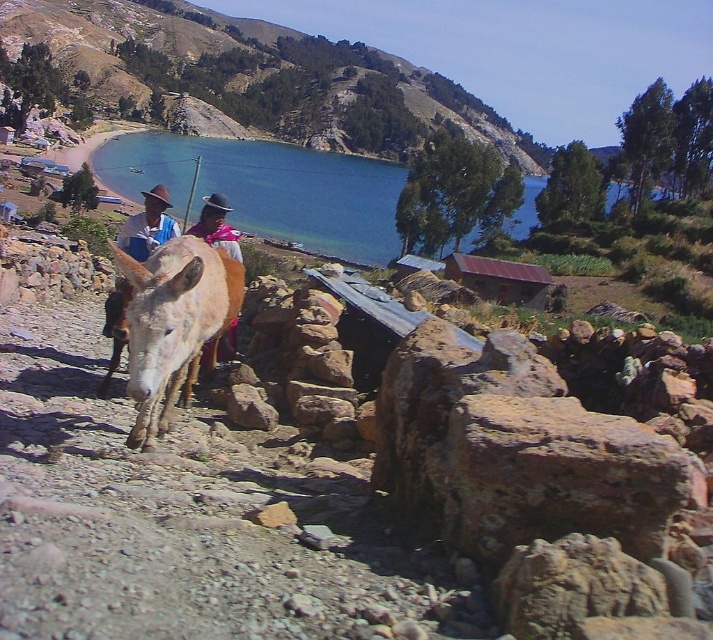
You are a photographer trying to capture the donkey and the hillside in a single frame. Based on the scene, can you determine if the green grassy hillside at upper center will appear taller than the light brown fur donkey at center in your photo?

The green grassy hillside at upper center is taller than the light brown fur donkey at center, so yes, the hillside will appear taller in the photo.

Based on the scene, which object is closer to the viewer between the green grassy hillside at upper center and the blue water at center?

The green grassy hillside at upper center is closer to the viewer because the blue water at center is behind it.

You are a hiker who wants to take a photo of the blue water at center and the green grassy hillside at upper center. Which object should you focus on first if you want to capture both in one frame?

The green grassy hillside at upper center is positioned on the left side of blue water at center, so you should focus on the green grassy hillside at upper center first to ensure both are in the frame.